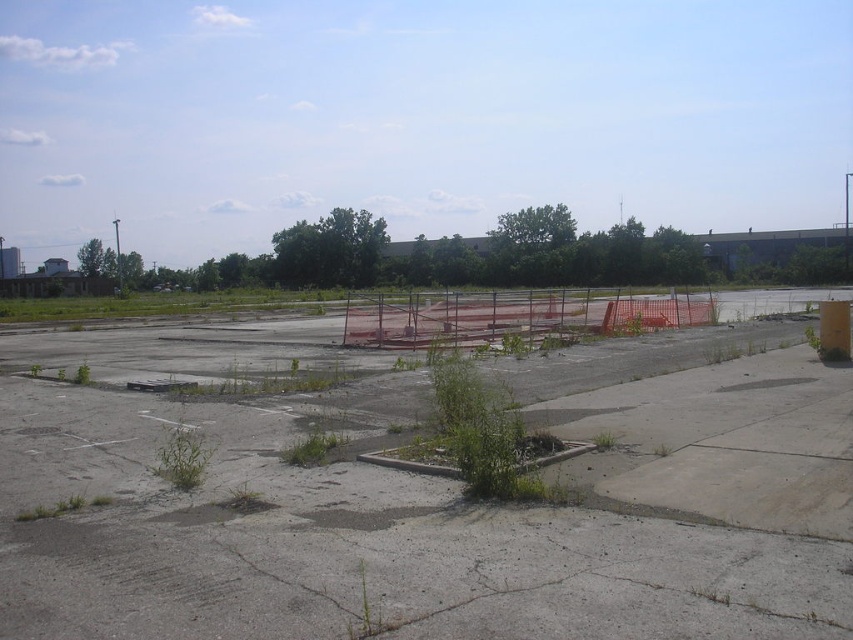
Find the location of a particular element. This screenshot has height=640, width=853. orange mesh fence at center is located at coordinates (514, 316).

Can you confirm if orange mesh fence at center is positioned to the left of green grassy weed at lower left?

Incorrect, orange mesh fence at center is not on the left side of green grassy weed at lower left.

What do you see at coordinates (514, 316) in the screenshot?
I see `orange mesh fence at center` at bounding box center [514, 316].

Find the location of a particular element. The height and width of the screenshot is (640, 853). orange mesh fence at center is located at coordinates (514, 316).

Looking at this image, is gray concrete pavement at center to the left of green leafy plant at center from the viewer's perspective?

Incorrect, gray concrete pavement at center is not on the left side of green leafy plant at center.

Is gray concrete pavement at center further to camera compared to green leafy plant at center?

No, it is not.

What do you see at coordinates (427, 497) in the screenshot?
I see `gray concrete pavement at center` at bounding box center [427, 497].

Where is `gray concrete pavement at center`? This screenshot has height=640, width=853. gray concrete pavement at center is located at coordinates (427, 497).

Measure the distance from gray concrete pavement at center to orange mesh fence at center.

gray concrete pavement at center and orange mesh fence at center are 13.13 meters apart.

You are a GUI agent. You are given a task and a screenshot of the screen. Output one action in this format:
    pyautogui.click(x=<x>, y=<y>)
    Task: Click on the gray concrete pavement at center
    
    Given the screenshot: What is the action you would take?
    pyautogui.click(x=427, y=497)

Who is more distant from viewer, (384, 557) or (502, 301)?

The point (502, 301) is behind.

Where is `gray concrete pavement at center`? This screenshot has width=853, height=640. gray concrete pavement at center is located at coordinates (427, 497).